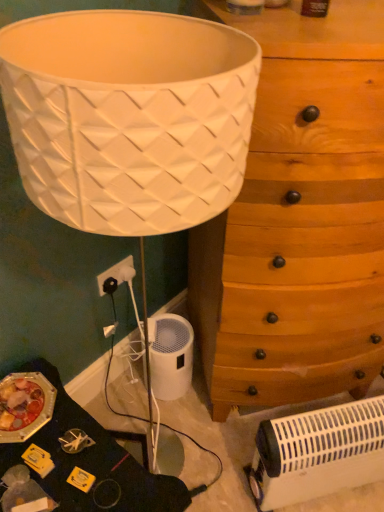
Question: Does wooden chest of drawers at center-right have a smaller size compared to white plastic electric outlet at lower left?

Choices:
 (A) no
 (B) yes

Answer: (A)

Question: Does wooden chest of drawers at center-right appear on the left side of white plastic electric outlet at lower left?

Choices:
 (A) no
 (B) yes

Answer: (A)

Question: Is wooden chest of drawers at center-right outside of white plastic electric outlet at lower left?

Choices:
 (A) yes
 (B) no

Answer: (A)

Question: From a real-world perspective, is wooden chest of drawers at center-right physically below white plastic electric outlet at lower left?

Choices:
 (A) yes
 (B) no

Answer: (B)

Question: Is wooden chest of drawers at center-right oriented away from white plastic electric outlet at lower left?

Choices:
 (A) yes
 (B) no

Answer: (B)

Question: Does wooden chest of drawers at center-right come in front of white plastic electric outlet at lower left?

Choices:
 (A) yes
 (B) no

Answer: (A)

Question: Considering the relative sizes of white plastic heater at lower right and white plastic electric outlet at lower left in the image provided, is white plastic heater at lower right thinner than white plastic electric outlet at lower left?

Choices:
 (A) yes
 (B) no

Answer: (B)

Question: Can you confirm if white plastic heater at lower right is positioned to the right of white plastic electric outlet at lower left?

Choices:
 (A) yes
 (B) no

Answer: (A)

Question: Considering the relative positions of white plastic heater at lower right and white plastic electric outlet at lower left in the image provided, is white plastic heater at lower right to the left of white plastic electric outlet at lower left from the viewer's perspective?

Choices:
 (A) no
 (B) yes

Answer: (A)

Question: Is white plastic heater at lower right bigger than white plastic electric outlet at lower left?

Choices:
 (A) yes
 (B) no

Answer: (A)

Question: Is white plastic heater at lower right oriented away from white plastic electric outlet at lower left?

Choices:
 (A) yes
 (B) no

Answer: (B)

Question: Is the position of white plastic heater at lower right less distant than that of white plastic electric outlet at lower left?

Choices:
 (A) yes
 (B) no

Answer: (A)

Question: Is the position of white plastic heater at lower right less distant than that of wooden chest of drawers at center-right?

Choices:
 (A) no
 (B) yes

Answer: (A)